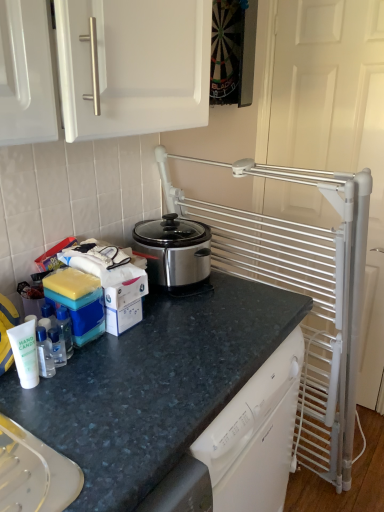
Question: Is point (64, 365) positioned closer to the camera than point (175, 304)?

Choices:
 (A) closer
 (B) farther

Answer: (A)

Question: Is clear plastic bottle at left, which is counted as the second bottle, starting from the back, taller or shorter than granite dark blue countertop at center?

Choices:
 (A) tall
 (B) short

Answer: (B)

Question: Which is farther from the granite dark blue countertop at center?

Choices:
 (A) white matte hand sanitizer at lower left, which is the fourth bottle from back to front
 (B) clear plastic bottle at left, arranged as the third bottle when viewed from the front
 (C) clear plastic bottle at lower left, which is the 3th bottle from back to front
 (D) clear plastic bottle at left, the first bottle viewed from the back
 (E) stainless steel slow cooker at center

Answer: (A)

Question: Which object is the farthest from the clear plastic bottle at lower left, marked as the second bottle in a front-to-back arrangement?

Choices:
 (A) stainless steel slow cooker at center
 (B) white metal screen door at right
 (C) clear plastic bottle at left, the first bottle viewed from the back
 (D) granite dark blue countertop at center
 (E) clear plastic bottle at left, arranged as the third bottle when viewed from the front

Answer: (B)